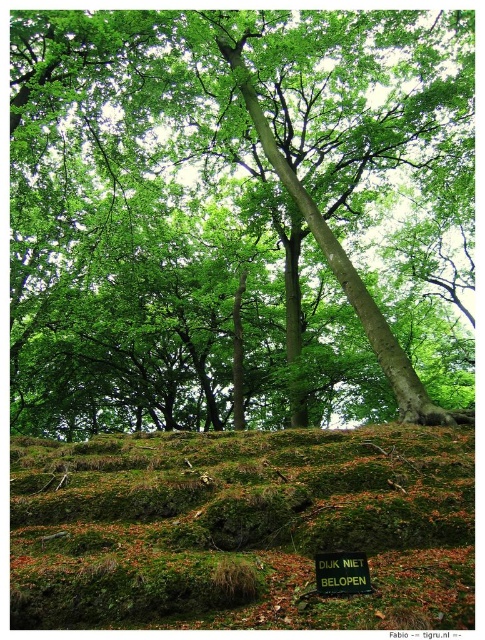
Question: Can you confirm if green leafy tree at center is positioned to the left of green mossy hillside at lower center?

Choices:
 (A) yes
 (B) no

Answer: (B)

Question: Which point is farther from the camera taking this photo?

Choices:
 (A) (392, 500)
 (B) (439, 160)

Answer: (B)

Question: Can you confirm if green leafy tree at center is wider than green mossy hillside at lower center?

Choices:
 (A) no
 (B) yes

Answer: (B)

Question: Is green leafy tree at center positioned in front of green mossy hillside at lower center?

Choices:
 (A) yes
 (B) no

Answer: (B)

Question: Which object is farther from the camera taking this photo?

Choices:
 (A) green leafy tree at center
 (B) green mossy hillside at lower center

Answer: (A)